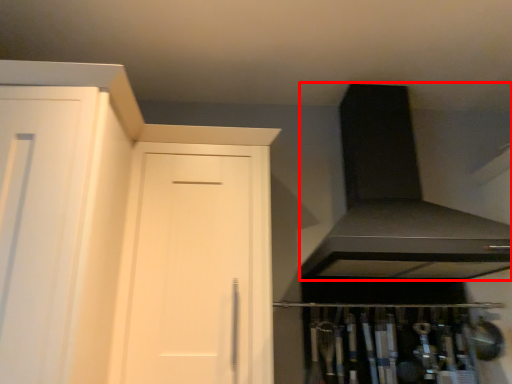
Question: From the image's perspective, where is exhaust hood (annotated by the red box) located relative to door?

Choices:
 (A) below
 (B) above

Answer: (B)